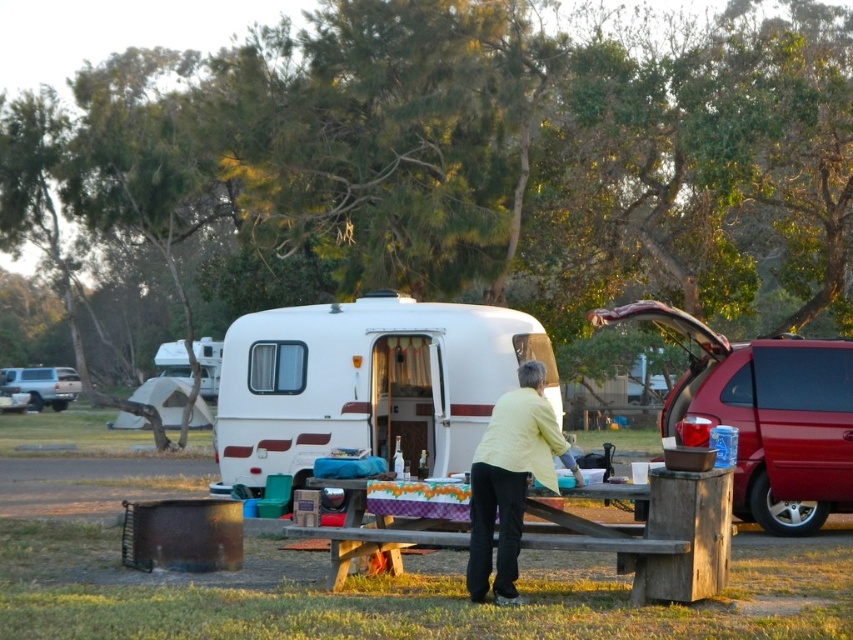
From the picture: You are planning to set up a tent near the white glossy camper at center. Based on the coordinates provided, where exactly should you place your tent to ensure it is positioned at the same horizontal level as the camper?

The white glossy camper at center is located at coordinates point (x=366, y=384). To place your tent at the same horizontal level, you should set it at the same x coordinate, which is 0.600, ensuring it aligns horizontally with the camper.

You are standing at the center of the image. Which direction should you walk to reach the metallic red van at right?

You should walk to the right to reach the metallic red van at right since it is located at the right side of the image.